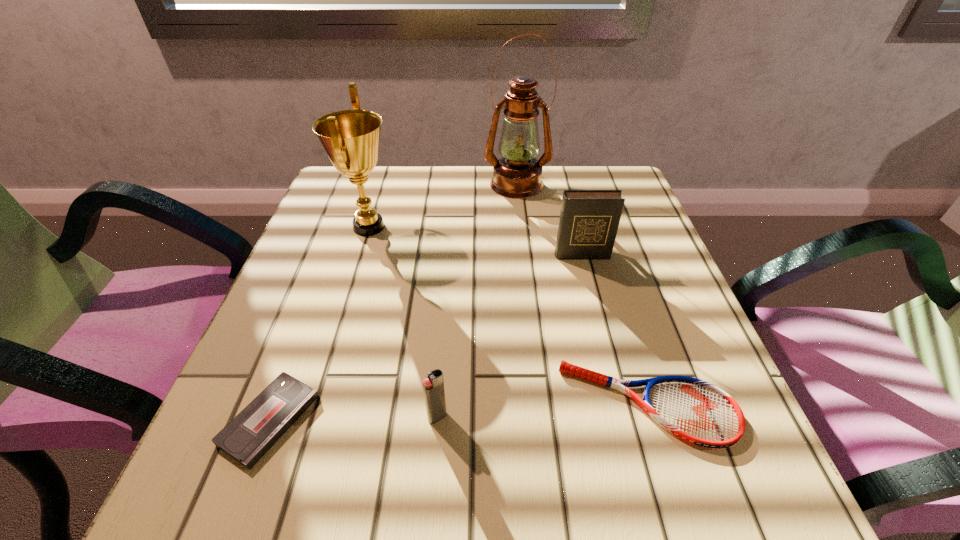
The height and width of the screenshot is (540, 960). In order to click on free space between the third object from left to right and the third tallest object in this screenshot , I will do `click(510, 336)`.

Where is `vacant space in between the award and the igniter`? This screenshot has width=960, height=540. vacant space in between the award and the igniter is located at coordinates click(x=403, y=322).

Locate which object ranks in proximity to the third shortest object. Please provide its 2D coordinates. Your answer should be formatted as a tuple, i.e. [(x, y)], where the tuple contains the x and y coordinates of a point satisfying the conditions above.

[(246, 438)]

Identify the location of object that is the closest to the diary. (517, 174).

Where is `free region that satisfies the following two spatial constraints: 1. on the back side of the fourth object from right to left; 2. on the front view with handles of the award`? This screenshot has height=540, width=960. free region that satisfies the following two spatial constraints: 1. on the back side of the fourth object from right to left; 2. on the front view with handles of the award is located at coordinates (452, 227).

What are the coordinates of `vacant space that satisfies the following two spatial constraints: 1. on the front cover of the tennis racket; 2. on the right side of the diary` in the screenshot? It's located at (620, 404).

This screenshot has width=960, height=540. In order to click on free spot that satisfies the following two spatial constraints: 1. on the back side of the igniter; 2. on the right side of the videotape in this screenshot , I will do `click(271, 417)`.

Identify the location of free point that satisfies the following two spatial constraints: 1. on the front cover of the tennis racket; 2. on the left side of the third tallest object. This screenshot has height=540, width=960. (620, 404).

I want to click on free space that satisfies the following two spatial constraints: 1. on the front view with handles of the third shortest object; 2. on the left side of the award, so click(x=310, y=417).

Locate an element on the screen. vacant space that satisfies the following two spatial constraints: 1. on the front view with handles of the fifth shortest object; 2. on the back side of the igniter is located at coordinates (310, 417).